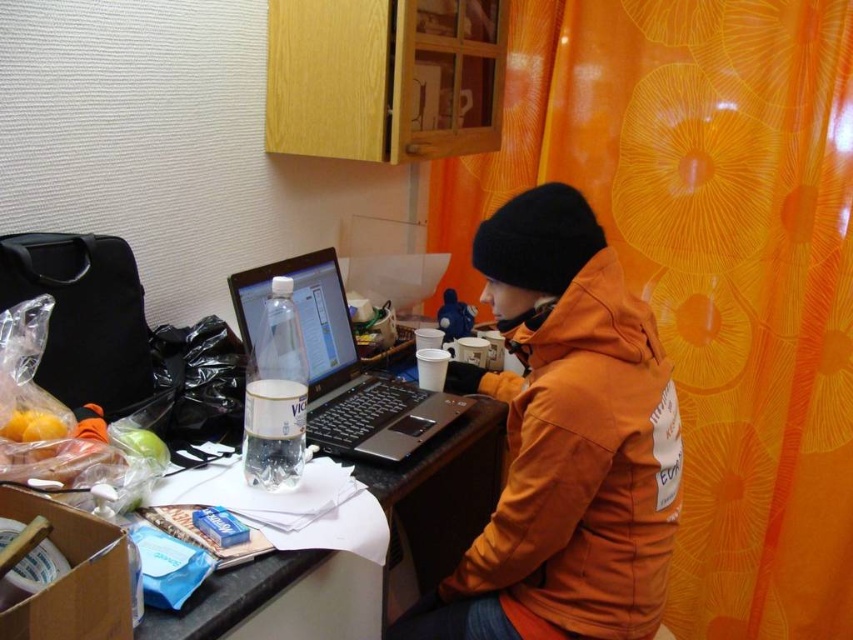
At what (x,y) coordinates should I click in order to perform the action: click on orange floral curtain at upper right. Please return your answer as a coordinate pair (x, y). The image size is (853, 640). Looking at the image, I should click on (709, 266).

Does orange floral curtain at upper right lie behind black plastic laptop at center?

Yes, orange floral curtain at upper right is behind black plastic laptop at center.

Which is in front, point (753, 600) or point (398, 428)?

Positioned in front is point (398, 428).

Find the location of `orange floral curtain at upper right`. orange floral curtain at upper right is located at coordinates (709, 266).

Between orange puffy jacket at center and black plastic laptop at center, which one appears on the right side from the viewer's perspective?

From the viewer's perspective, orange puffy jacket at center appears more on the right side.

Who is shorter, orange puffy jacket at center or black plastic laptop at center?

black plastic laptop at center is shorter.

Does point (608, 497) come behind point (345, 426)?

No, (608, 497) is in front of (345, 426).

Where is `orange puffy jacket at center`? This screenshot has height=640, width=853. orange puffy jacket at center is located at coordinates (566, 442).

Does orange floral curtain at upper right appear on the left side of orange puffy jacket at center?

In fact, orange floral curtain at upper right is to the right of orange puffy jacket at center.

Does orange floral curtain at upper right appear over orange puffy jacket at center?

Result: Correct, orange floral curtain at upper right is located above orange puffy jacket at center.

Is point (792, 60) closer to viewer compared to point (555, 326)?

No, it is behind (555, 326).

Identify the location of orange floral curtain at upper right. (709, 266).